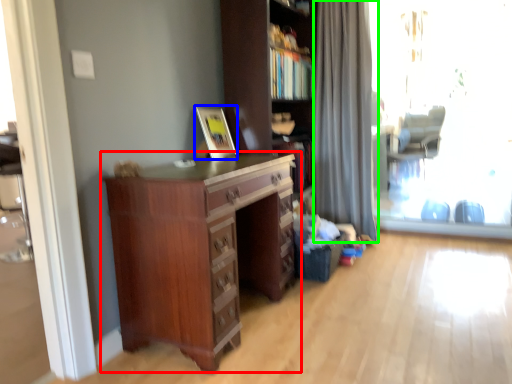
Question: Which is nearer to the chest of drawers (highlighted by a red box)? picture frame (highlighted by a blue box) or curtain (highlighted by a green box).

Choices:
 (A) picture frame
 (B) curtain

Answer: (A)